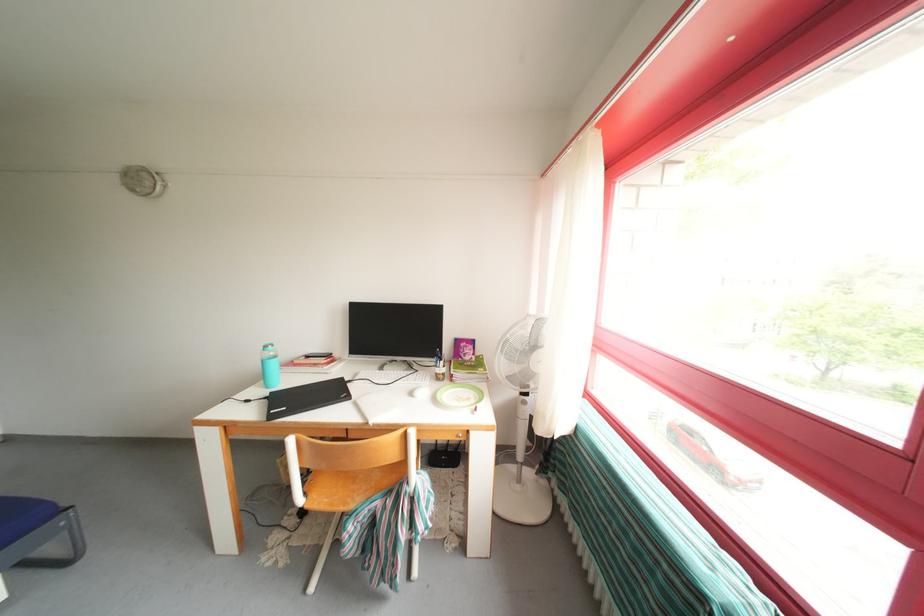
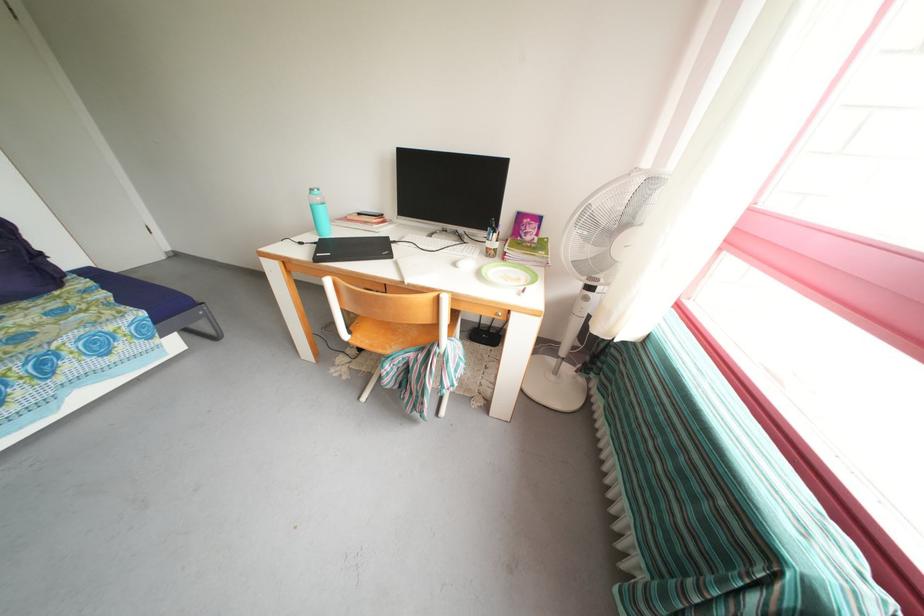
In the second image, find the point that corresponds to point 308,507 in the first image.

(353, 342)